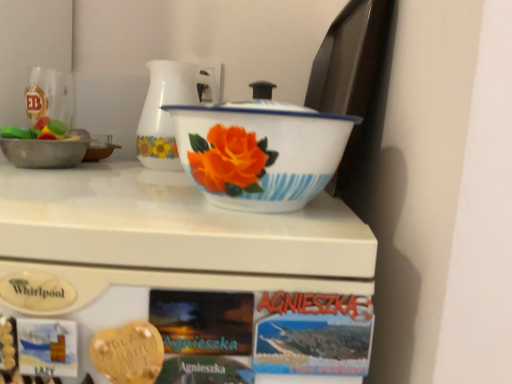
Question: From the image's perspective, is white glossy refrigerator at upper center positioned above or below white enamel basin at center?

Choices:
 (A) below
 (B) above

Answer: (A)

Question: From their relative heights in the image, would you say white glossy refrigerator at upper center is taller or shorter than white enamel basin at center?

Choices:
 (A) short
 (B) tall

Answer: (B)

Question: Estimate the real-world distances between objects in this image. Which object is closer to the white glossy jug at center?

Choices:
 (A) white enamel basin at center
 (B) golden heart-shaped cookie at center
 (C) white glossy refrigerator at upper center

Answer: (C)

Question: Which of these objects is positioned farthest from the white glossy refrigerator at upper center?

Choices:
 (A) white enamel basin at center
 (B) white glossy jug at center
 (C) golden heart-shaped cookie at center

Answer: (B)